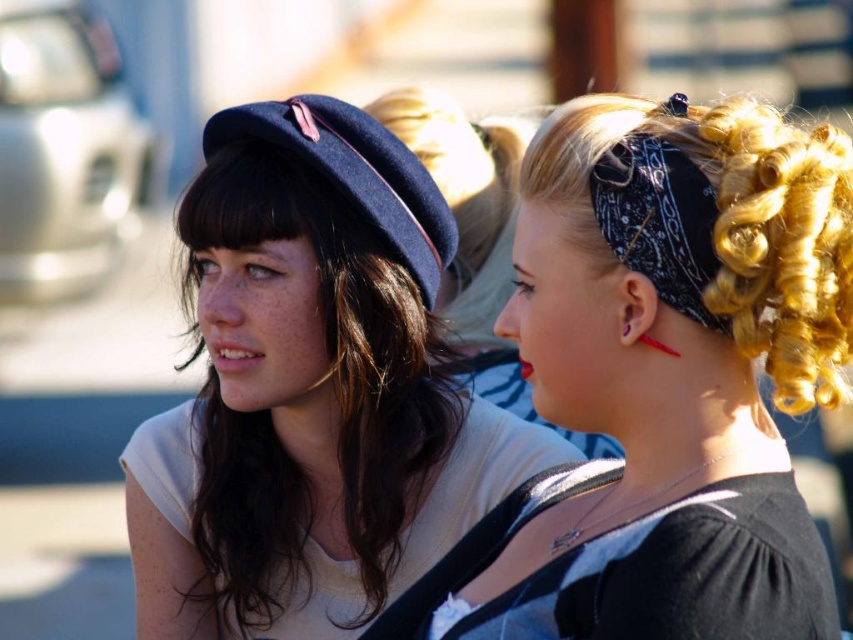
Does black bandana at right come in front of dark brown silky hair at center?

Yes, black bandana at right is closer to the viewer.

This screenshot has width=853, height=640. Describe the element at coordinates (674, 368) in the screenshot. I see `black bandana at right` at that location.

Is point (641, 154) positioned after point (410, 294)?

No.

The height and width of the screenshot is (640, 853). I want to click on black bandana at right, so click(x=674, y=368).